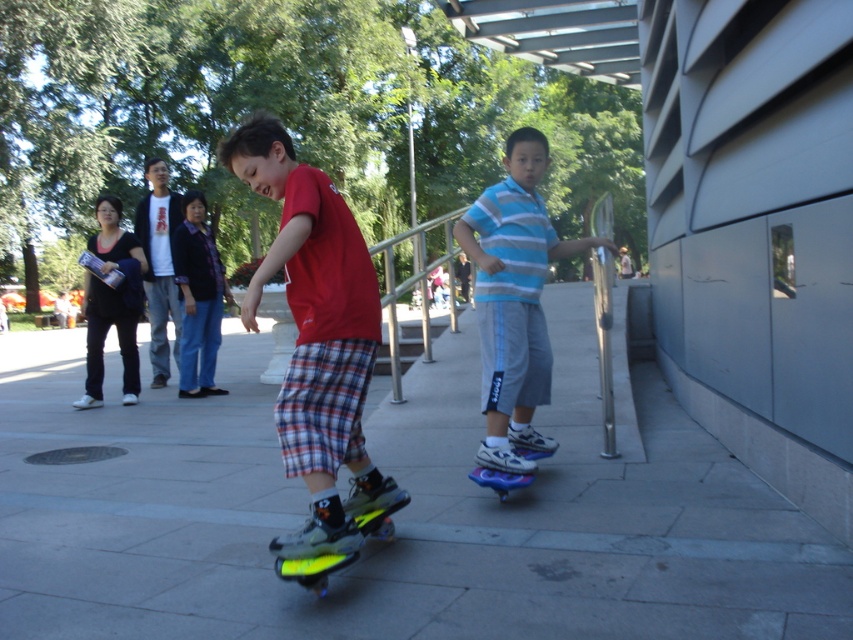
Question: Which point is closer to the camera?

Choices:
 (A) (189, 276)
 (B) (381, 490)

Answer: (B)

Question: Estimate the real-world distances between objects in this image. Which object is closer to the neon yellow roller skates at center?

Choices:
 (A) neon yellow inline skate at center
 (B) plaid shorts at center

Answer: (A)

Question: Can you confirm if blue striped shirt at center is positioned to the right of neon yellow inline skate at center?

Choices:
 (A) yes
 (B) no

Answer: (A)

Question: Where is gray concrete pavement at center located in relation to shiny blue skateboard at lower center in the image?

Choices:
 (A) left
 (B) right

Answer: (A)

Question: Estimate the real-world distances between objects in this image. Which object is farther from the shiny blue skateboard at lower center?

Choices:
 (A) plaid shorts at center
 (B) gray concrete pavement at center
 (C) neon yellow plastic roller skate at lower center
 (D) neon yellow roller skates at center

Answer: (A)

Question: Observing the image, what is the correct spatial positioning of blue striped shirt at center in reference to shiny blue skateboard at lower center?

Choices:
 (A) left
 (B) right

Answer: (B)